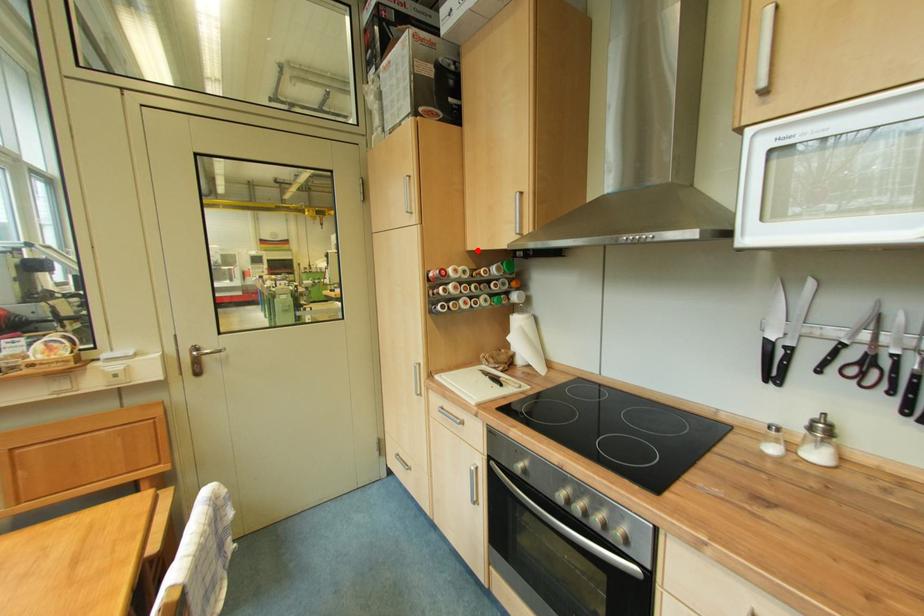
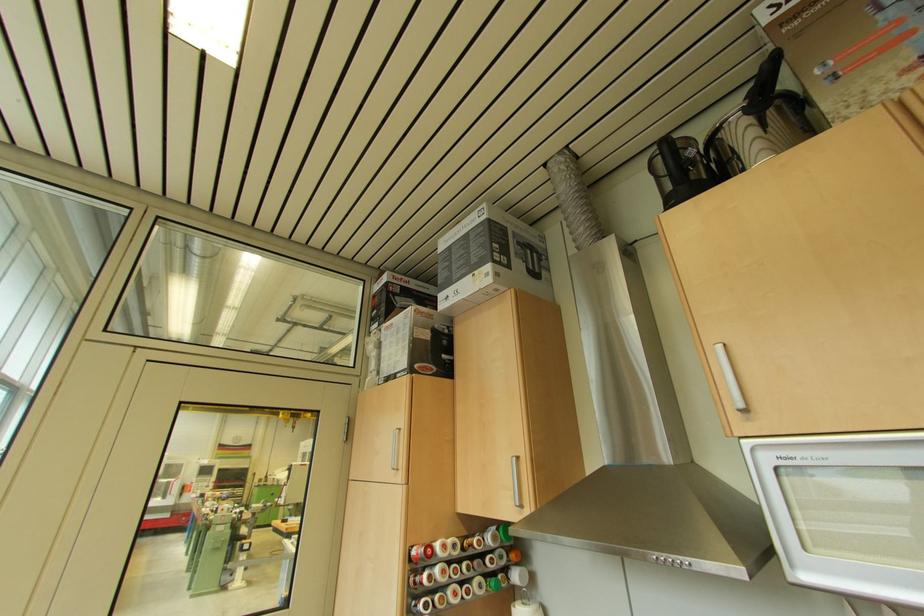
Locate, in the second image, the point that corresponds to the highlighted location in the first image.

(468, 513)